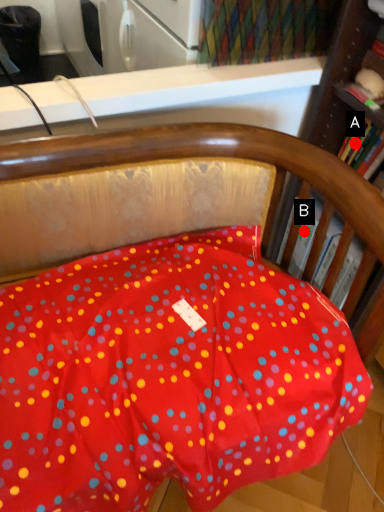
Question: Two points are circled on the image, labeled by A and B beside each circle. Which point is farther from the camera taking this photo?

Choices:
 (A) A is further
 (B) B is further

Answer: (A)